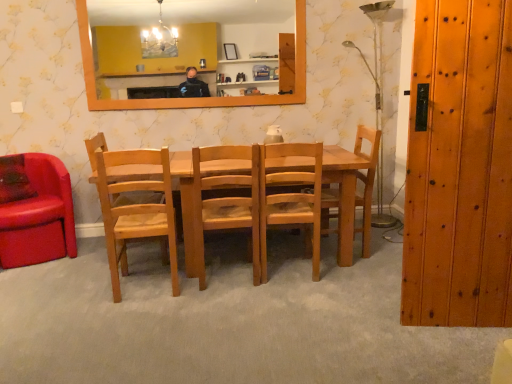
This screenshot has height=384, width=512. I want to click on free space in front of natural wood chair at left, the 2th chair from the left, so click(x=132, y=316).